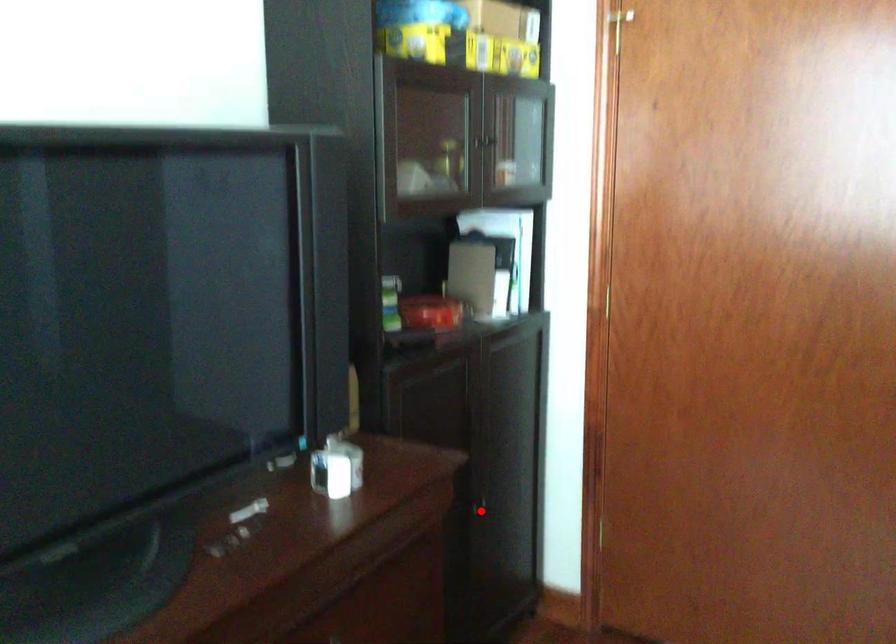
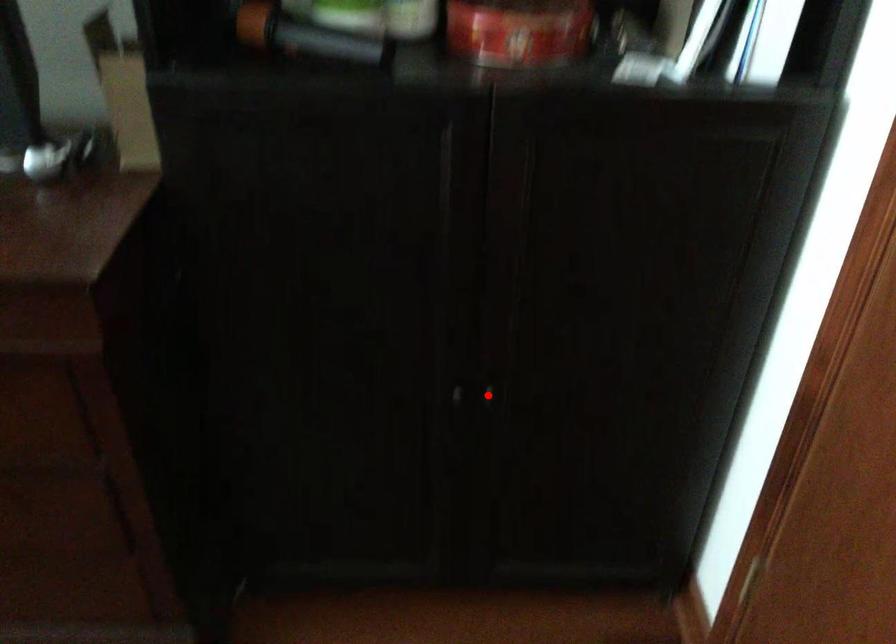
I am providing you with two images of the same scene from different viewpoints. A red point is marked on the first image and another point is marked on the second image. Does the point marked in image1 correspond to the same location as the one in image2?

Yes